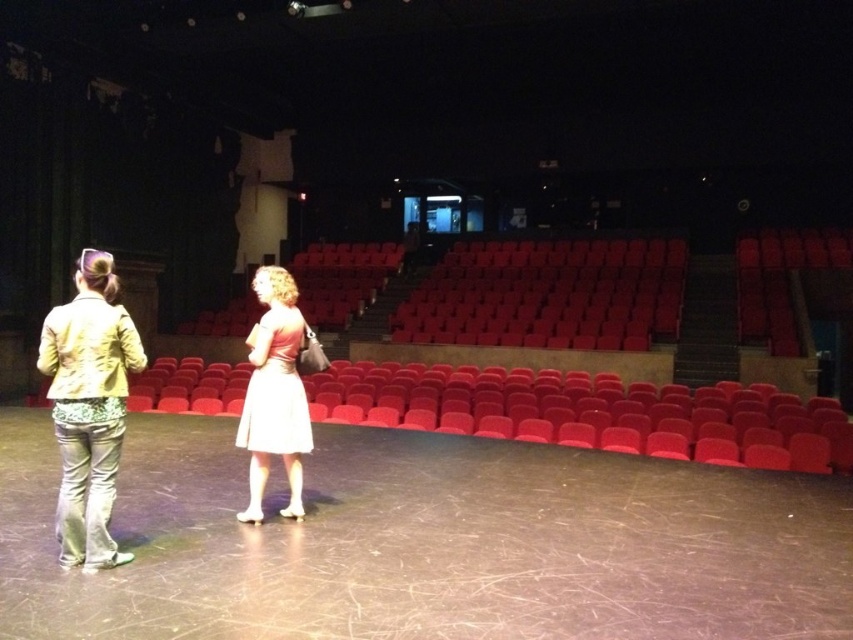
Is light yellow fabric jacket at left wider than white satin dress at center?

Indeed, light yellow fabric jacket at left has a greater width compared to white satin dress at center.

Who is taller, light yellow fabric jacket at left or white satin dress at center?

light yellow fabric jacket at left

Describe the element at coordinates (88, 406) in the screenshot. I see `light yellow fabric jacket at left` at that location.

Locate an element on the screen. The image size is (853, 640). light yellow fabric jacket at left is located at coordinates (88, 406).